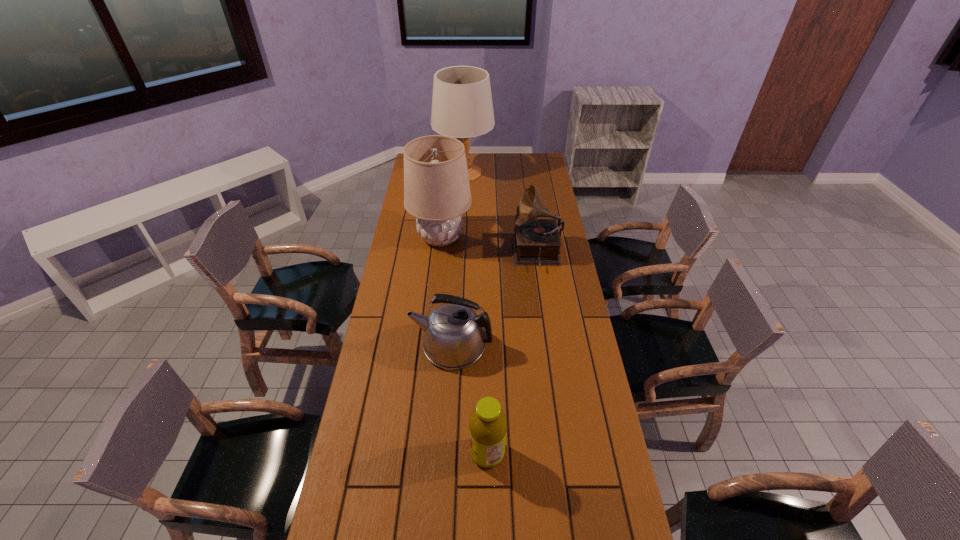
The image size is (960, 540). I want to click on the tallest object, so click(462, 107).

Where is `the farthest object`? The image size is (960, 540). the farthest object is located at coordinates (462, 107).

The width and height of the screenshot is (960, 540). I want to click on lampshade, so click(x=437, y=193).

The image size is (960, 540). I want to click on the third shortest object, so click(536, 242).

Locate an element on the screen. The height and width of the screenshot is (540, 960). record player is located at coordinates (536, 242).

Locate an element on the screen. The height and width of the screenshot is (540, 960). the second nearest object is located at coordinates (454, 338).

This screenshot has height=540, width=960. I want to click on the nearest object, so click(x=488, y=424).

Locate an element on the screen. The height and width of the screenshot is (540, 960). blank space located 0.380m on the front of the table lamp is located at coordinates (461, 232).

Find the location of a particular element. The width and height of the screenshot is (960, 540). free space located 0.160m on the right of the lampshade is located at coordinates (507, 238).

Locate an element on the screen. The width and height of the screenshot is (960, 540). vacant region located 0.360m from the horn of the rightmost object is located at coordinates (431, 254).